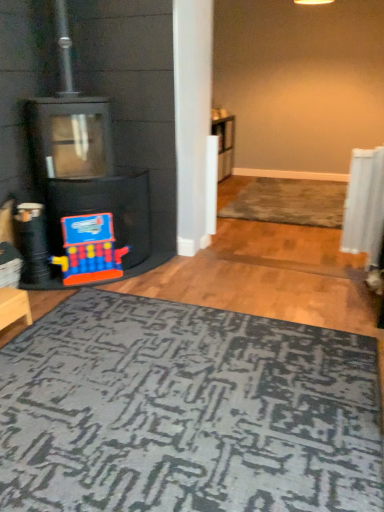
At what (x,y) coordinates should I click in order to perform the action: click on vacant region under dark gray textured rug at lower center (from a real-world perspective). Please return your answer as a coordinate pair (x, y). This screenshot has height=512, width=384. Looking at the image, I should click on (186, 390).